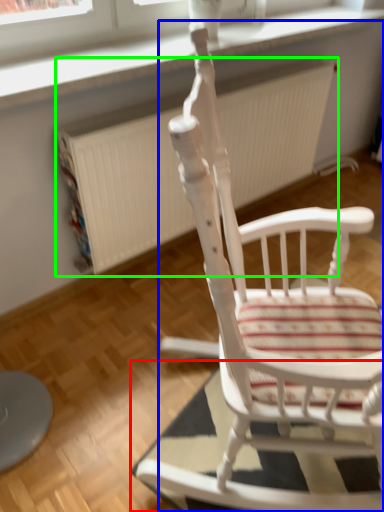
Question: Which is nearer to the mat (highlighted by a red box)? chair (highlighted by a blue box) or radiator (highlighted by a green box).

Choices:
 (A) chair
 (B) radiator

Answer: (A)